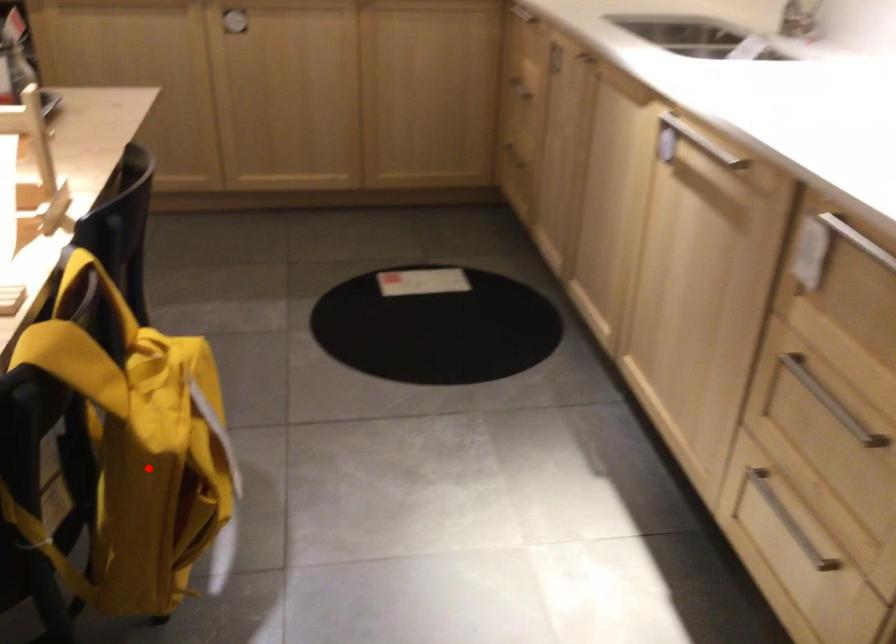
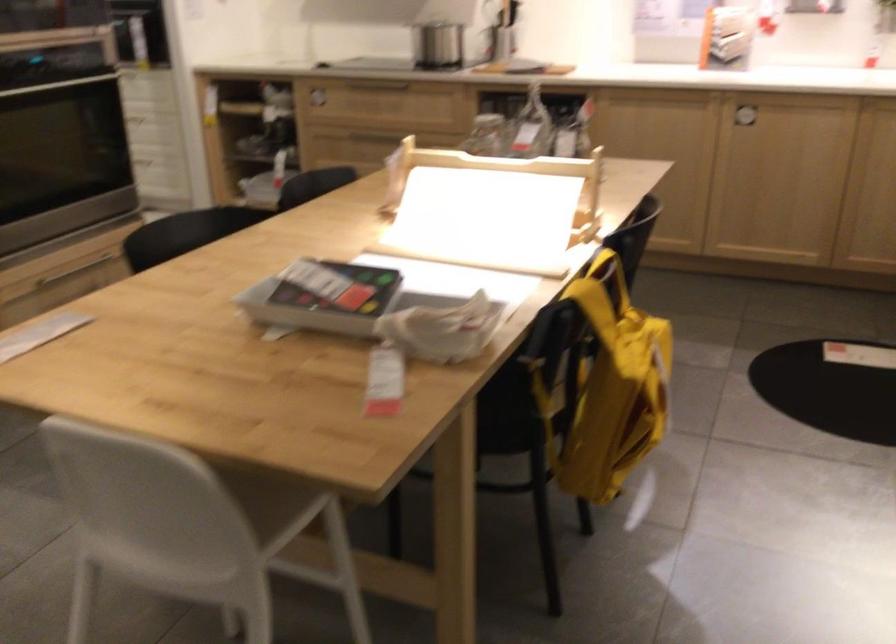
Question: A red point is marked in image1. In image2, is the corresponding 3D point closer to the camera or farther? Reply with the corresponding letter.

Choices:
 (A) The corresponding 3D point is closer.
 (B) The corresponding 3D point is farther.

Answer: (B)